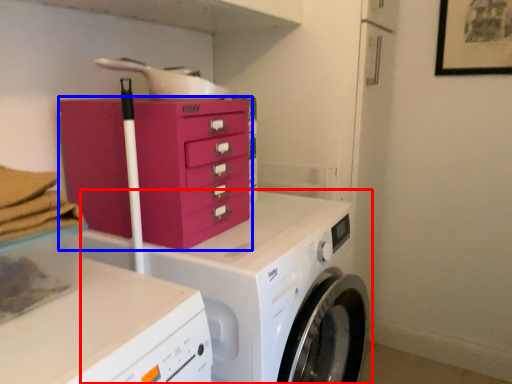
Question: Which of the following is the closest to the observer, washing machine (highlighted by a red box) or chest of drawers (highlighted by a blue box)?

Choices:
 (A) washing machine
 (B) chest of drawers

Answer: (A)